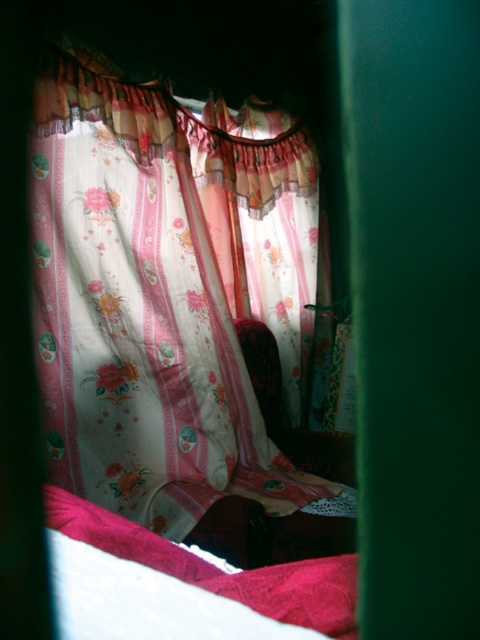
You are a painter standing 1.5 meters away from the floral sheer curtain at upper center. You want to paint it using a brush that has a maximum reach of 1.6 meters. Can you reach the curtain without moving closer?

The distance of floral sheer curtain at upper center from viewer is 1.59 meters, so yes, the painter can reach it with the brush since the distance is within the brushs maximum reach of 1.6 meters.

You are standing in front of the room and want to know where the floral sheer curtain at upper center is located. Please provide its coordinates in the image.

The floral sheer curtain at upper center is located at coordinates point (144, 305).

You are a delivery person trying to place a small package between the floral sheer curtain at upper center and the velvet red blanket at lower left. Can you fit the package there if it measures 1 meter in length?

The distance between the floral sheer curtain at upper center and the velvet red blanket at lower left is 1.10 meters. Since the package is 1 meter long, it can fit in the space between them.